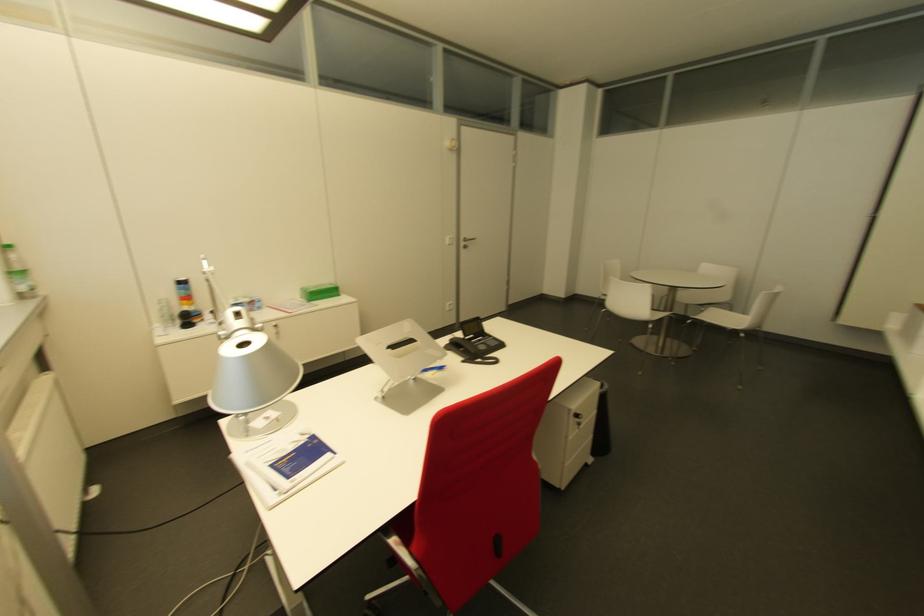
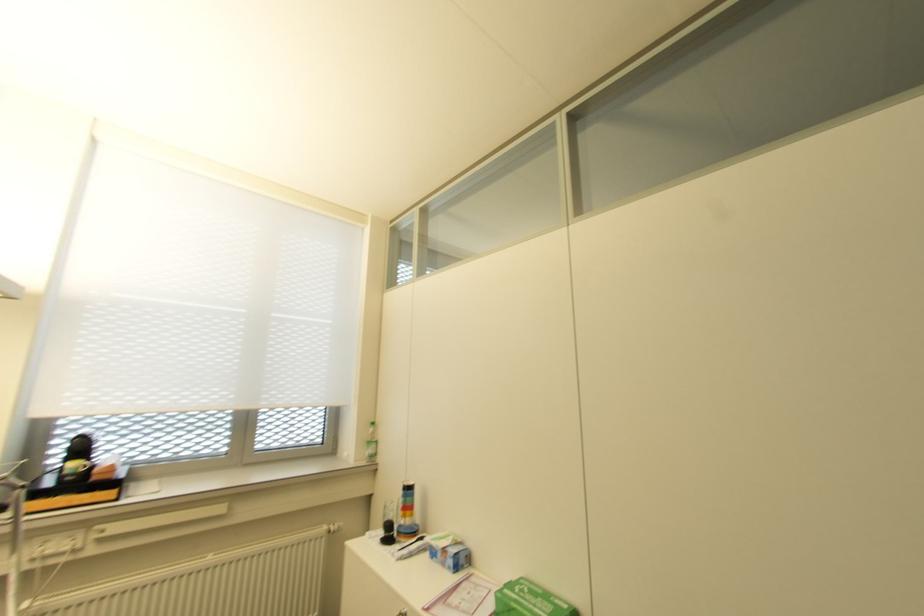
Locate, in the second image, the point that corresponds to point (188, 304) in the first image.

(402, 517)